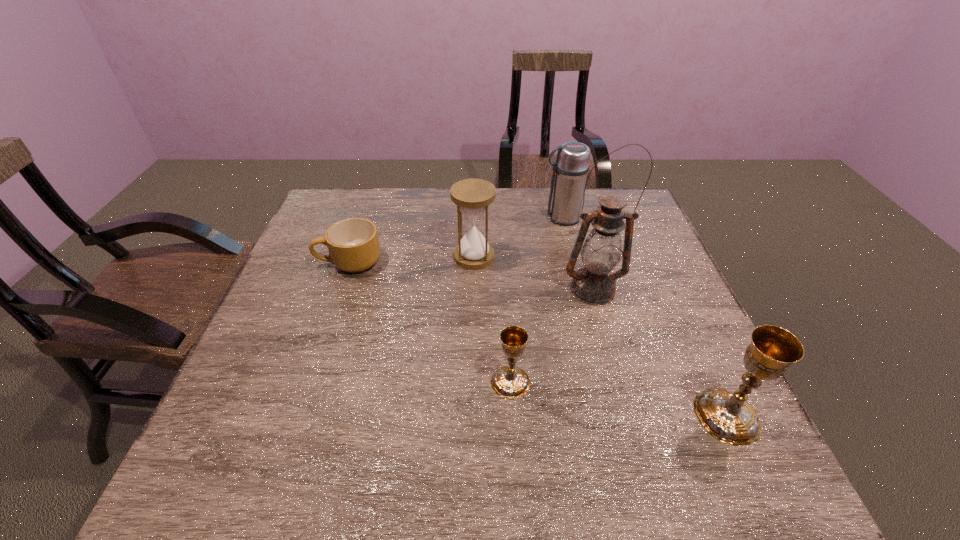
You are a GUI agent. You are given a task and a screenshot of the screen. Output one action in this format:
    pyautogui.click(x=<x>, y=<y>)
    Task: Click on the vacant space located 0.170m on the left of the rightmost object
    The image size is (960, 540).
    Given the screenshot: What is the action you would take?
    pyautogui.click(x=611, y=416)

Where is `free region located 0.170m with a handle on the side of the thermos bottle`? The width and height of the screenshot is (960, 540). free region located 0.170m with a handle on the side of the thermos bottle is located at coordinates (489, 218).

Where is `free space located with a handle on the side of the thermos bottle`? The height and width of the screenshot is (540, 960). free space located with a handle on the side of the thermos bottle is located at coordinates [492, 218].

Image resolution: width=960 pixels, height=540 pixels. Find the location of `vacant area located 0.210m with a handle on the side of the thermos bottle`. vacant area located 0.210m with a handle on the side of the thermos bottle is located at coordinates (475, 218).

Where is `free location located 0.160m on the back of the hourglass`? The width and height of the screenshot is (960, 540). free location located 0.160m on the back of the hourglass is located at coordinates (474, 213).

The height and width of the screenshot is (540, 960). In order to click on vacant space situated on the front of the oil lamp in this screenshot , I will do `click(617, 380)`.

Identify the location of object positioned at the far edge. This screenshot has height=540, width=960. (571, 167).

Where is `object at the left edge`? object at the left edge is located at coordinates (353, 244).

This screenshot has height=540, width=960. Identify the location of chalice that is at the right edge. (x=726, y=415).

Image resolution: width=960 pixels, height=540 pixels. Identify the location of oil lamp at the right edge. [594, 284].